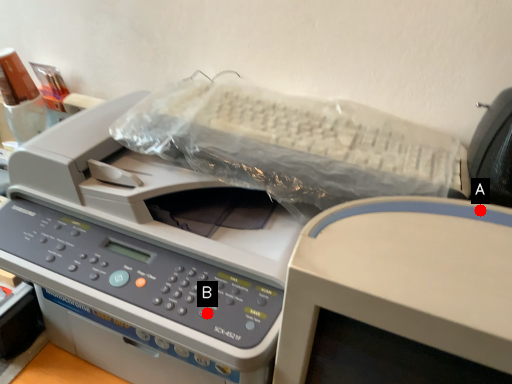
Question: Two points are circled on the image, labeled by A and B beside each circle. Among these points, which one is nearest to the camera?

Choices:
 (A) A is closer
 (B) B is closer

Answer: (A)